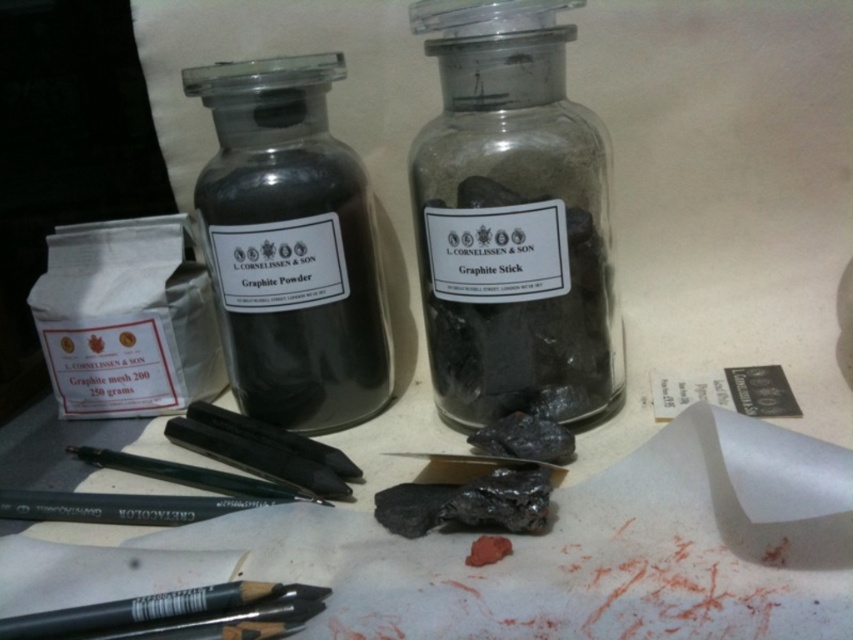
Question: Among these objects, which one is farthest from the camera?

Choices:
 (A) transparent glass jar at center
 (B) matte black pencil at lower left

Answer: (A)

Question: Which point is closer to the camera?

Choices:
 (A) matte black pencil at center
 (B) transparent glass jar at center
 (C) matte black pencil at lower left

Answer: (C)

Question: Estimate the real-world distances between objects in this image. Which object is farther from the matte black pencil at lower left?

Choices:
 (A) matte black pencil at center
 (B) transparent glass jar at center
 (C) matte glass bottle at center

Answer: (B)

Question: Does matte black pencil at lower left lie in front of matte black pencil at center?

Choices:
 (A) yes
 (B) no

Answer: (A)

Question: Observing the image, what is the correct spatial positioning of transparent glass jar at center in reference to matte black pencil at center?

Choices:
 (A) left
 (B) right

Answer: (B)

Question: Does transparent glass jar at center appear under matte glass bottle at center?

Choices:
 (A) yes
 (B) no

Answer: (B)